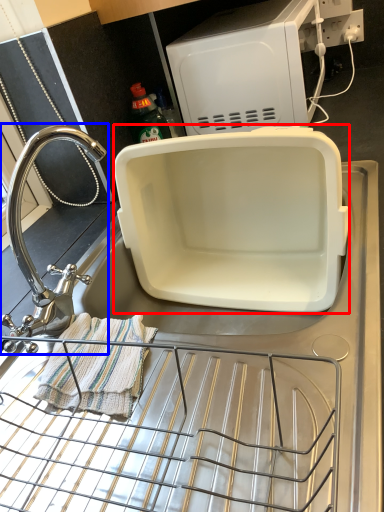
Question: Which point is closer to the camera, appliance (highlighted by a red box) or tap (highlighted by a blue box)?

Choices:
 (A) appliance
 (B) tap

Answer: (B)